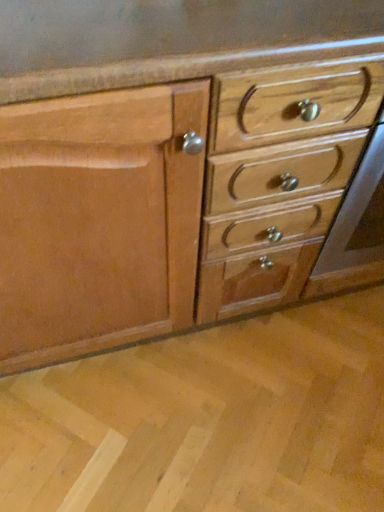
At what (x,y) coordinates should I click in order to perform the action: click on light brown wood chest of drawers at center. Please return your answer as a coordinate pair (x, y). The image size is (384, 512). Looking at the image, I should click on (212, 188).

The width and height of the screenshot is (384, 512). Describe the element at coordinates (212, 188) in the screenshot. I see `light brown wood chest of drawers at center` at that location.

Measure the distance between point (x=99, y=267) and camera.

Point (x=99, y=267) and camera are 32.17 inches apart.

Locate an element on the screen. This screenshot has height=512, width=384. light brown wood chest of drawers at center is located at coordinates (212, 188).